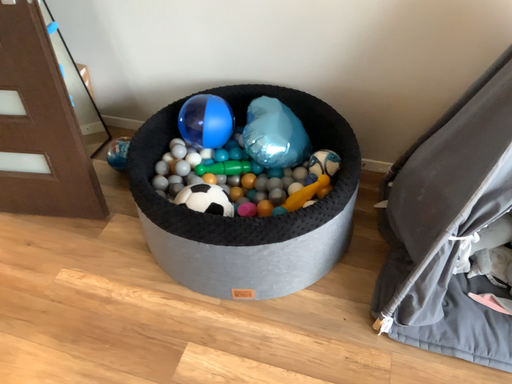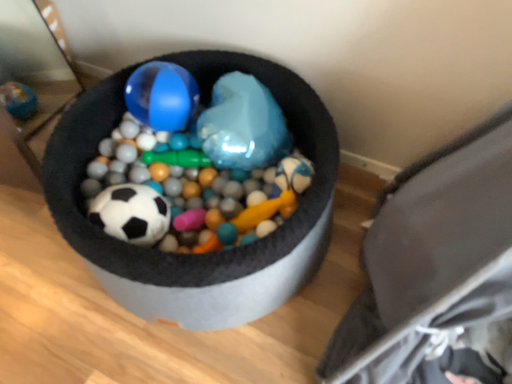
Question: How did the camera likely rotate when shooting the video?

Choices:
 (A) rotated upward
 (B) rotated downward

Answer: (B)